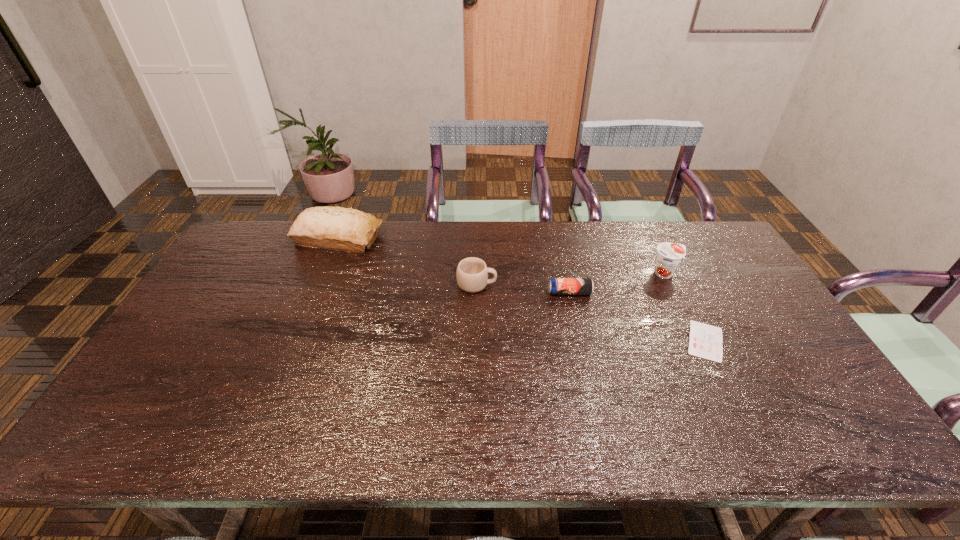
Where is `free region that satisfies the following two spatial constraints: 1. on the front side of the leftmost object; 2. on the right side of the second shortest object`? free region that satisfies the following two spatial constraints: 1. on the front side of the leftmost object; 2. on the right side of the second shortest object is located at coordinates (316, 293).